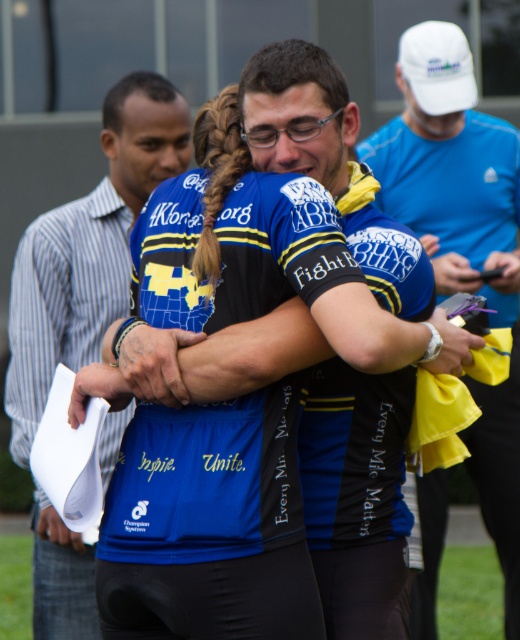
Question: Considering the real-world distances, which object is farthest from the blue jersey at center?

Choices:
 (A) matte blue jersey at center
 (B) blue jersey at left

Answer: (A)

Question: In this image, where is matte blue jersey at center located relative to blue jersey at center?

Choices:
 (A) below
 (B) above

Answer: (B)

Question: Is matte blue jersey at center above blue jersey at center?

Choices:
 (A) no
 (B) yes

Answer: (B)

Question: Which point is closer to the camera taking this photo?

Choices:
 (A) (491, 387)
 (B) (384, 563)

Answer: (B)

Question: Which point is farther from the camera taking this photo?

Choices:
 (A) (515, 410)
 (B) (105, 144)
 (C) (342, 100)

Answer: (A)

Question: Does blue jersey at left appear over blue jersey at center?

Choices:
 (A) yes
 (B) no

Answer: (A)